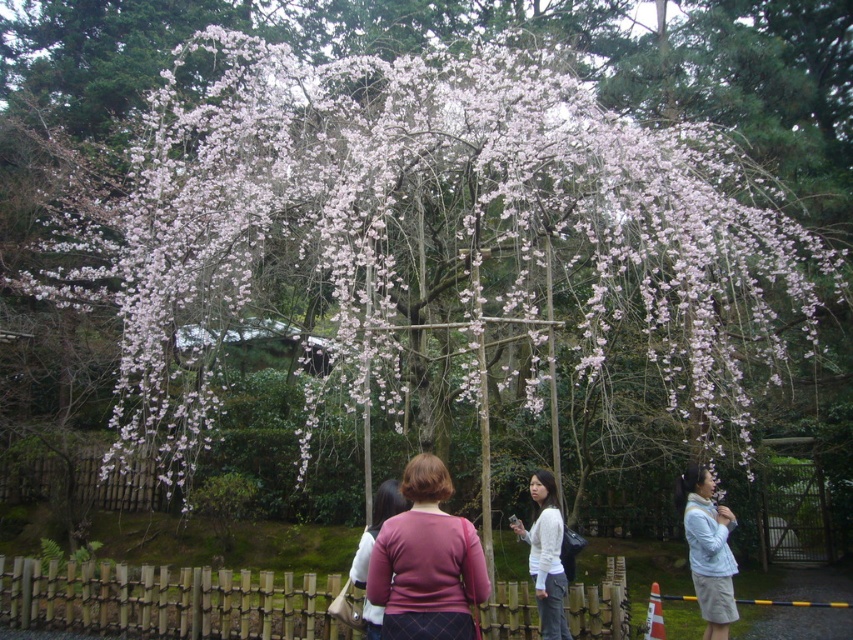
You are trying to decide which sweater to wear for a photoshoot in the cherry blossom garden. Both the pink fabric sweater at center and the matte pink sweater at center are available. Based on their width, which one would allow you to move more comfortably between the low wooden fence and the cherry blossom tree?

The pink fabric sweater at center is wider than the matte pink sweater at center. Therefore, the matte pink sweater at center would allow for more comfortable movement between the low wooden fence and the cherry blossom tree since it is narrower.

You are a photographer trying to capture both the white matte shirt at center and the matte pink sweater at center in the same frame. Which clothing item will appear bigger in your photo?

The white matte shirt at center will appear bigger in the photo because it is larger in size than the matte pink sweater at center.

You are standing in the outdoor scene and want to find the wooden object. Based on the coordinates provided, where should you look to locate the wooden at center?

The wooden at center is located at coordinates point (x=167, y=600), so you should look towards the lower right area of the image to find it.